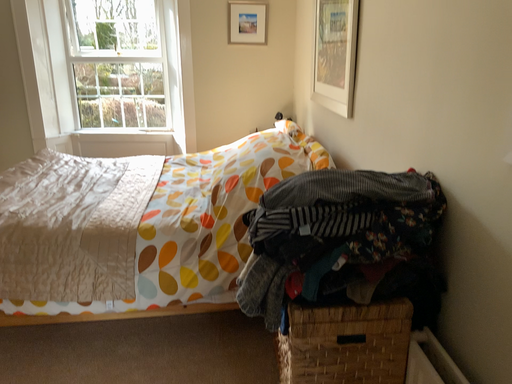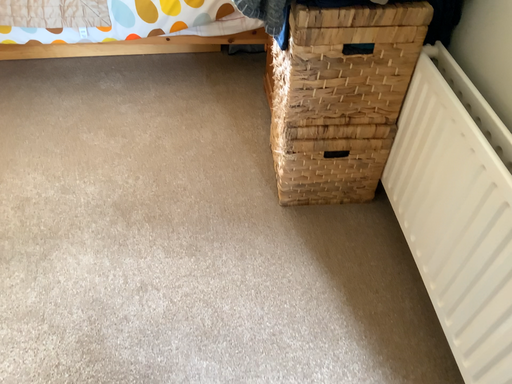
Question: Which way did the camera rotate in the video?

Choices:
 (A) rotated upward
 (B) rotated downward

Answer: (B)